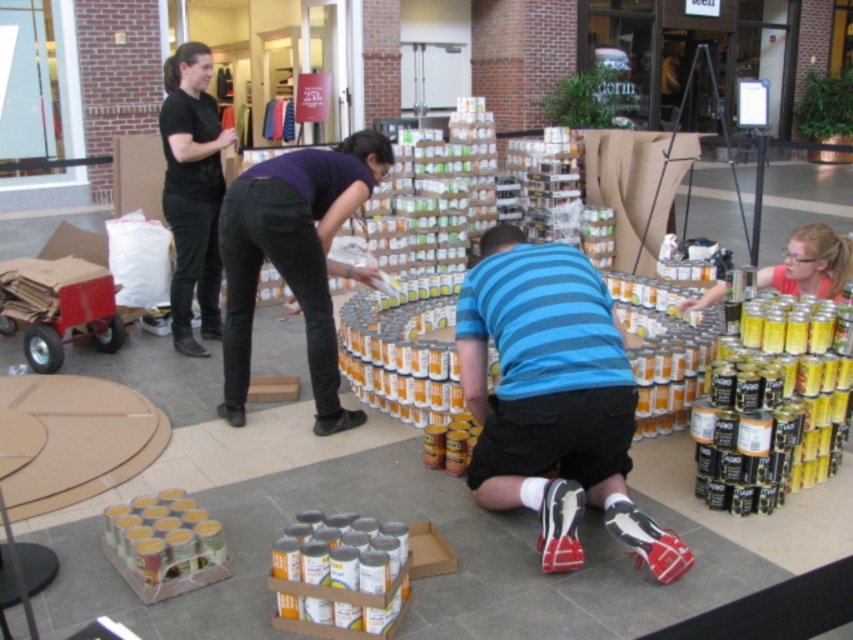
Is purple matte shirt at center thinner than matte yellow can at center?

In fact, purple matte shirt at center might be wider than matte yellow can at center.

Between point (317, 378) and point (836, 260), which one is positioned in front?

Point (317, 378) is more forward.

I want to click on purple matte shirt at center, so click(x=294, y=259).

Identify the location of purple matte shirt at center. The width and height of the screenshot is (853, 640). (294, 259).

Can you confirm if purple matte shirt at center is smaller than black matte pants at upper left?

Indeed, purple matte shirt at center has a smaller size compared to black matte pants at upper left.

What do you see at coordinates (294, 259) in the screenshot?
I see `purple matte shirt at center` at bounding box center [294, 259].

Is point (276, 202) closer to viewer compared to point (161, 109)?

That is True.

The height and width of the screenshot is (640, 853). Identify the location of purple matte shirt at center. (294, 259).

Can you confirm if blue striped shirt at center is positioned to the left of matte yellow can at center?

Correct, you'll find blue striped shirt at center to the left of matte yellow can at center.

Can you confirm if blue striped shirt at center is bigger than matte yellow can at center?

Yes.

Identify the location of blue striped shirt at center. Image resolution: width=853 pixels, height=640 pixels. (552, 397).